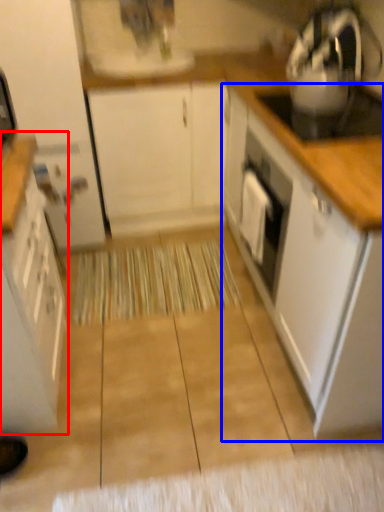
Question: Which point is further to the camera, cabinetry (highlighted by a red box) or cabinetry (highlighted by a blue box)?

Choices:
 (A) cabinetry
 (B) cabinetry

Answer: (B)